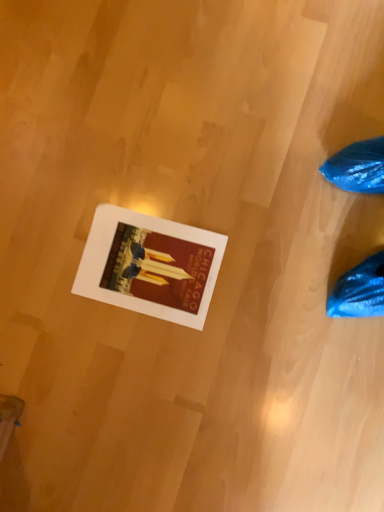
What are the coordinates of `white matte picture frame at lower left` in the screenshot? It's located at (150, 265).

The image size is (384, 512). Describe the element at coordinates (150, 265) in the screenshot. I see `white matte picture frame at lower left` at that location.

You are a GUI agent. You are given a task and a screenshot of the screen. Output one action in this format:
    pyautogui.click(x=<x>, y=<y>)
    Task: Click on the white matte picture frame at lower left
    The width and height of the screenshot is (384, 512).
    Given the screenshot: What is the action you would take?
    pyautogui.click(x=150, y=265)